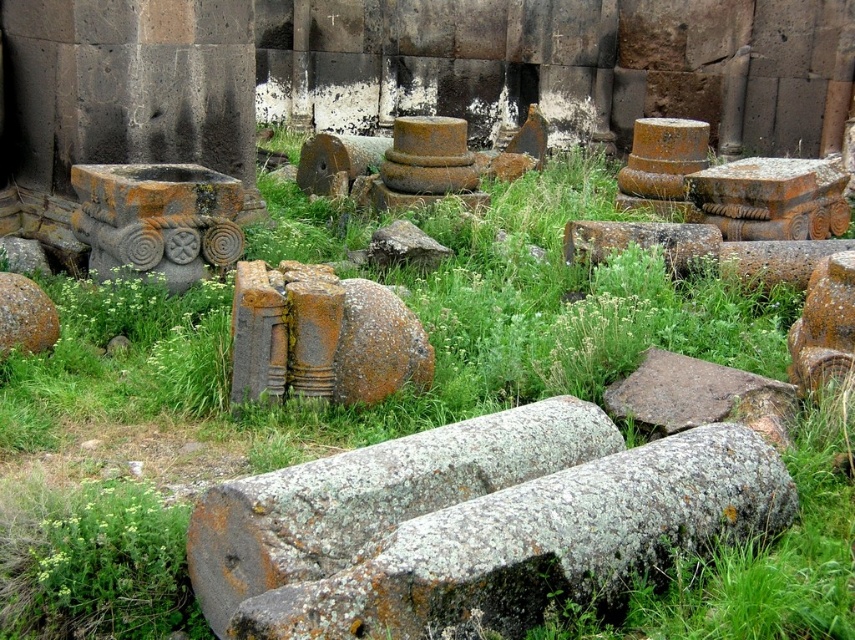
Question: Which point appears closest to the camera in this image?

Choices:
 (A) (805, 356)
 (B) (693, 264)
 (C) (688, 385)

Answer: (A)

Question: Does rusty stone column at center-right lie behind rusty metal column at center?

Choices:
 (A) yes
 (B) no

Answer: (B)

Question: Observing the image, what is the correct spatial positioning of lichen-covered stone at center in reference to rusty stone column at center-right?

Choices:
 (A) below
 (B) above

Answer: (A)

Question: Which object is farther from the camera taking this photo?

Choices:
 (A) rusty stone at lower left
 (B) rusty stone at center

Answer: (B)

Question: Which point is closer to the camera?

Choices:
 (A) (102, 566)
 (B) (848, 307)
 (C) (611, 394)

Answer: (A)

Question: Does rusty stone carving at center-left appear on the right side of rusty stone at center?

Choices:
 (A) no
 (B) yes

Answer: (A)